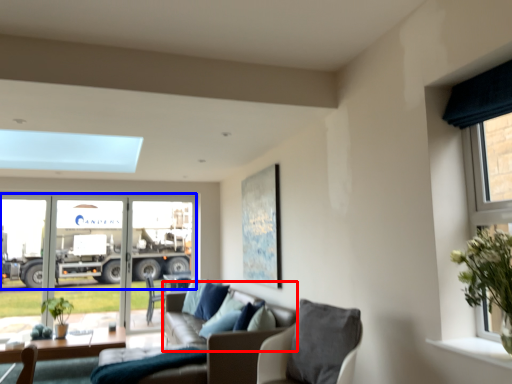
Question: Which object appears closest to the camera in this image, couch (highlighted by a red box) or trailer truck (highlighted by a blue box)?

Choices:
 (A) couch
 (B) trailer truck

Answer: (A)